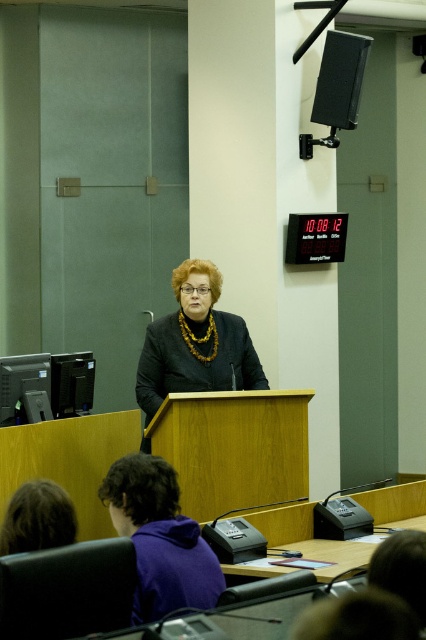
You are an event organizer who needs to set up a microphone stand between the matte black speaker at upper right and the black plastic computer at lower left. Which side should the microphone stand be placed closer to, the speaker or the computer, to ensure it is centered between them?

The matte black speaker at upper right is wider than the black plastic computer at lower left. To center the microphone stand between them, it should be placed closer to the black plastic computer at lower left since the speaker takes up more space on the right side.

You are organizing a meeting in this room and need to place a new whiteboard between the black plastic printer at left and the black plastic computer at lower left. Based on their current positions, where should the whiteboard be placed?

The black plastic printer at left is positioned on the left side of the black plastic computer at lower left, so the whiteboard should be placed between them, to the right of the printer and to the left of the computer.

You are organizing a meeting in this room and need to place a large banner between the black plastic printer at left and the black plastic computer at lower left. Which object should you place the banner closer to if you want the banner to be centered between them?

The black plastic printer at left is wider than the black plastic computer at lower left. To center the banner between them, you should place it closer to the black plastic computer at lower left since the printer takes up more space on the left side.